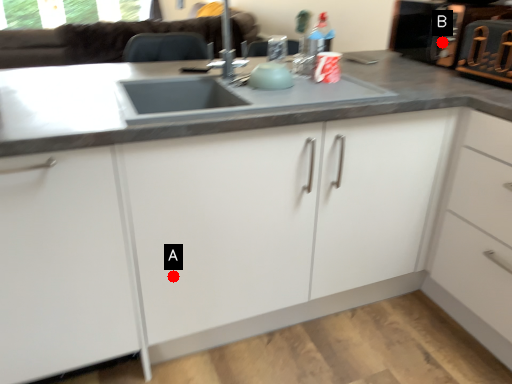
Question: Two points are circled on the image, labeled by A and B beside each circle. Which point is closer to the camera?

Choices:
 (A) A is closer
 (B) B is closer

Answer: (A)